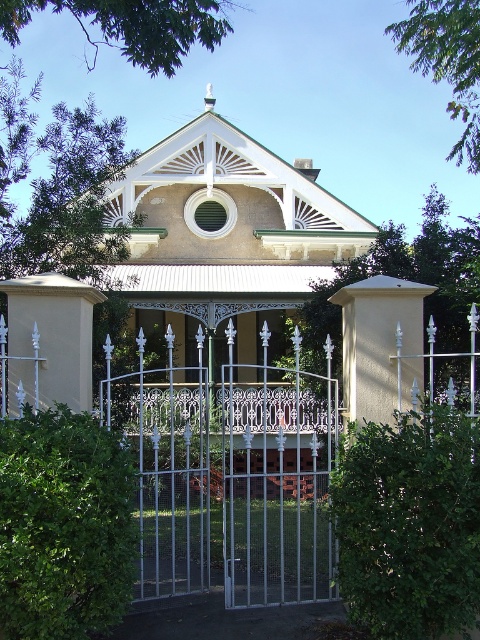
Which is below, white wrought iron gate at center or green leafy hedge at right?

Positioned lower is white wrought iron gate at center.

Which is above, white wrought iron gate at center or green leafy hedge at right?

green leafy hedge at right

What are the coordinates of `white wrought iron gate at center` in the screenshot? It's located at (277, 492).

Can you confirm if white wrought iron gate at center is positioned to the left of green leafy hedge at lower left?

In fact, white wrought iron gate at center is to the right of green leafy hedge at lower left.

Is white wrought iron gate at center bigger than green leafy hedge at lower left?

Yes, white wrought iron gate at center is bigger than green leafy hedge at lower left.

Does point (147, 481) come behind point (6, 604)?

Yes, point (147, 481) is farther from viewer.

You are a GUI agent. You are given a task and a screenshot of the screen. Output one action in this format:
    pyautogui.click(x=<x>, y=<y>)
    Task: Click on the white wrought iron gate at center
    The image size is (480, 640).
    Given the screenshot: What is the action you would take?
    pyautogui.click(x=277, y=492)

Which is behind, point (384, 524) or point (64, 445)?

The point (64, 445) is behind.

Which of these two, green leafy hedge at right or green leafy hedge at lower left, stands taller?

green leafy hedge at right

This screenshot has width=480, height=640. Describe the element at coordinates (409, 524) in the screenshot. I see `green leafy hedge at right` at that location.

This screenshot has height=640, width=480. In order to click on green leafy hedge at right in this screenshot , I will do `click(409, 524)`.